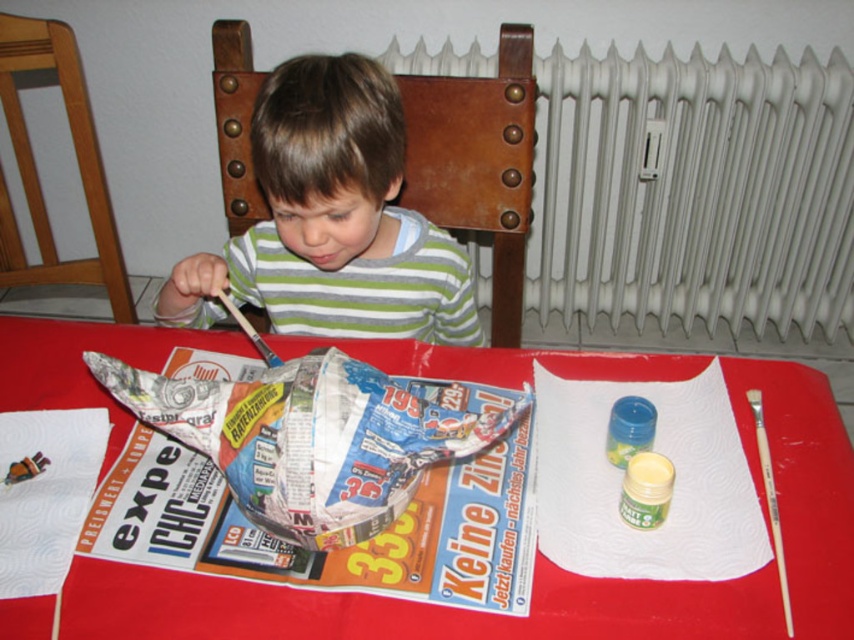
In the scene shown: Is red paper table at center thinner than wooden chair at left?

No, red paper table at center is not thinner than wooden chair at left.

Who is lower down, red paper table at center or wooden chair at left?

red paper table at center is below.

Is point (629, 611) farther from viewer compared to point (106, 268)?

That is False.

Find the location of a particular element. The image size is (854, 640). red paper table at center is located at coordinates (410, 609).

Can you confirm if white metallic radiator at upper center is smaller than green striped shirt at center?

No.

Which is more to the right, white metallic radiator at upper center or green striped shirt at center?

white metallic radiator at upper center

The width and height of the screenshot is (854, 640). Find the location of `white metallic radiator at upper center`. white metallic radiator at upper center is located at coordinates (693, 192).

Locate an element on the screen. This screenshot has width=854, height=640. white metallic radiator at upper center is located at coordinates (693, 192).

Is point (603, 104) positioned before point (509, 365)?

No, it is behind (509, 365).

The image size is (854, 640). Find the location of `white metallic radiator at upper center`. white metallic radiator at upper center is located at coordinates (693, 192).